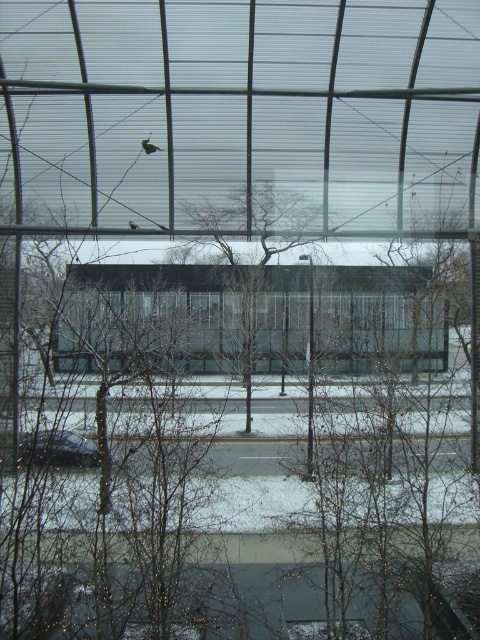
Between point (422, 324) and point (292, 237), which one is positioned behind?

Point (292, 237)

Does transparent glass window at center have a greater height compared to bare branches at center?

No, transparent glass window at center is not taller than bare branches at center.

The image size is (480, 640). Find the location of `transparent glass window at center`. transparent glass window at center is located at coordinates (188, 314).

Does point (377, 308) come in front of point (48, 458)?

No.

Looking at this image, does transparent glass window at center have a greater width compared to shiny black car at lower left?

Correct, the width of transparent glass window at center exceeds that of shiny black car at lower left.

Image resolution: width=480 pixels, height=640 pixels. I want to click on transparent glass window at center, so click(x=188, y=314).

Locate an element on the screen. Image resolution: width=480 pixels, height=640 pixels. transparent glass window at center is located at coordinates (188, 314).

Between bare branches at center and shiny black car at lower left, which one appears on the right side from the viewer's perspective?

bare branches at center is more to the right.

Between point (190, 216) and point (28, 445), which one is positioned behind?

The point (190, 216) is behind.

The width and height of the screenshot is (480, 640). Find the location of `bare branches at center`. bare branches at center is located at coordinates (260, 246).